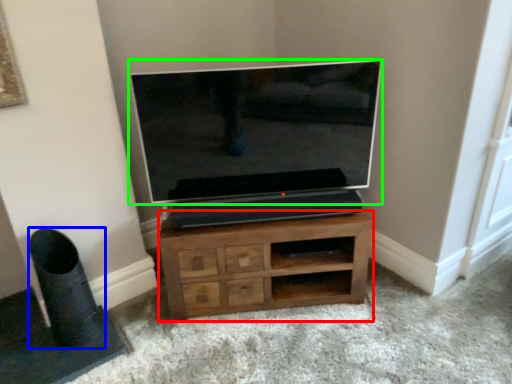
Question: Estimate the real-world distances between objects in this image. Which object is closer to chest of drawers (highlighted by a red box), speaker (highlighted by a blue box) or television (highlighted by a green box)?

Choices:
 (A) speaker
 (B) television

Answer: (B)